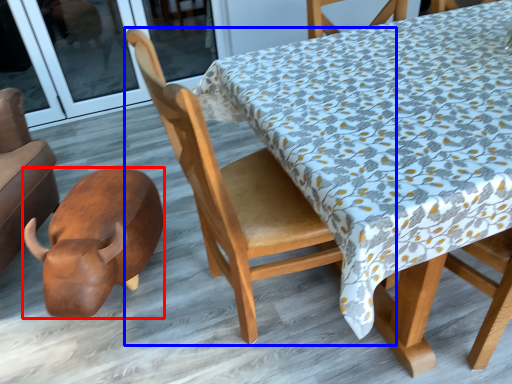
Question: Which object is closer to the camera taking this photo, animal (highlighted by a red box) or chair (highlighted by a blue box)?

Choices:
 (A) animal
 (B) chair

Answer: (B)